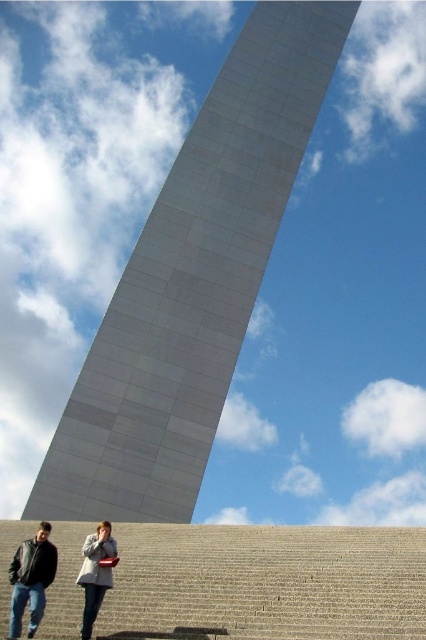
You are standing at the base of the obelisk and looking towards the top. There are two points marked on the obelisk surface at coordinates point (x=210, y=346) and point (x=83, y=545). Which point is closer to your current position?

Point (x=210, y=346) is further to the camera than point (x=83, y=545), so the point closer to your current position is point (x=83, y=545).

Looking at this image, you are standing at the base of the obelisk and want to place your light gray wool coat at lower center on the ground. However, there is a white smooth arch at center in the way. Can you place your coat directly under the arch?

The white smooth arch at center is located above the light gray wool coat at lower center, so yes, you can place your coat directly under the arch since the arch is positioned above it.

You are standing at the bottom of the gray concrete stairs at lower center and want to place your black leather jacket at lower left on the steps. Can you fit the jacket on the stairs?

The gray concrete stairs at lower center is bigger than the black leather jacket at lower left, so yes, the jacket can fit on the stairs.